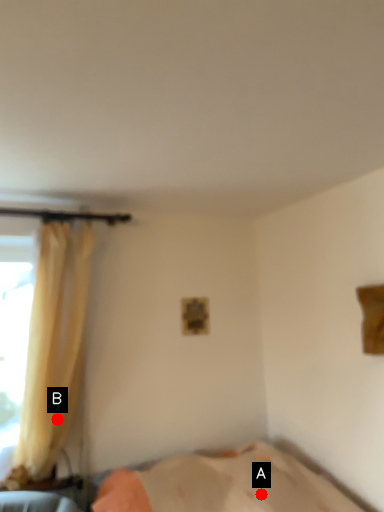
Question: Two points are circled on the image, labeled by A and B beside each circle. Which of the following is the closest to the observer?

Choices:
 (A) A is closer
 (B) B is closer

Answer: (A)